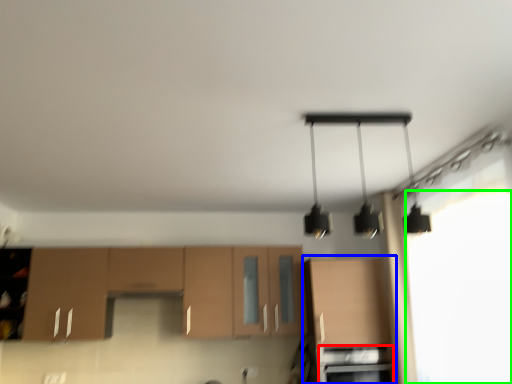
Question: Which is nearer to the oven (highlighted by a red box)? cabinetry (highlighted by a blue box) or window screen (highlighted by a green box).

Choices:
 (A) cabinetry
 (B) window screen

Answer: (A)